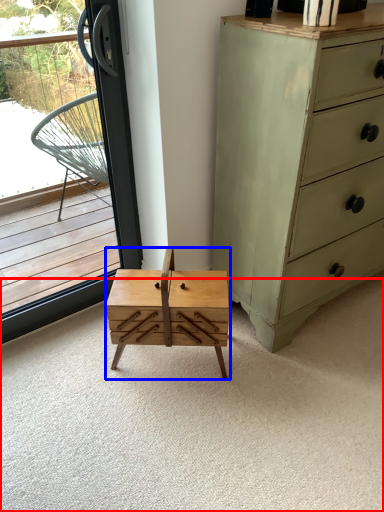
Question: Which object appears closest to the camera in this image, plain (highlighted by a red box) or table (highlighted by a blue box)?

Choices:
 (A) plain
 (B) table

Answer: (A)